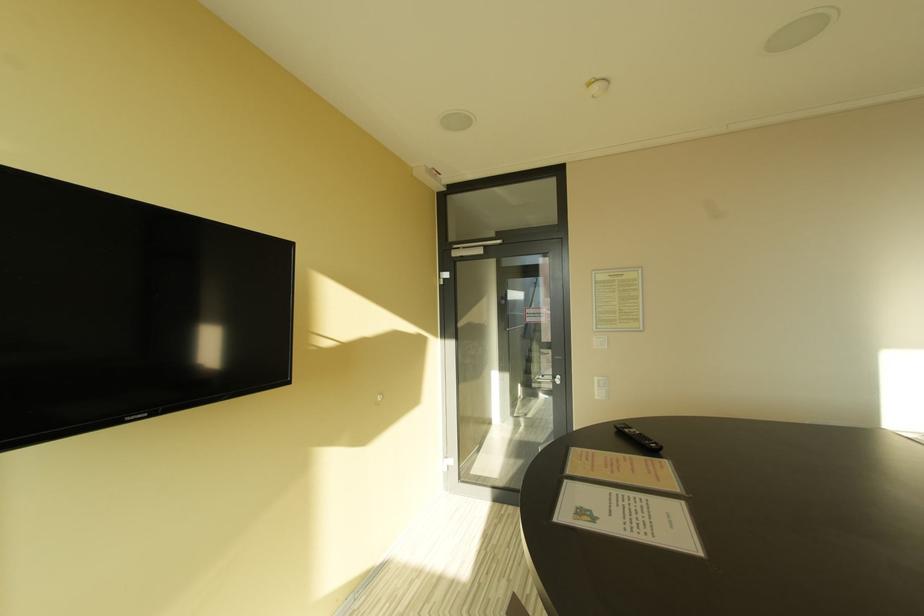
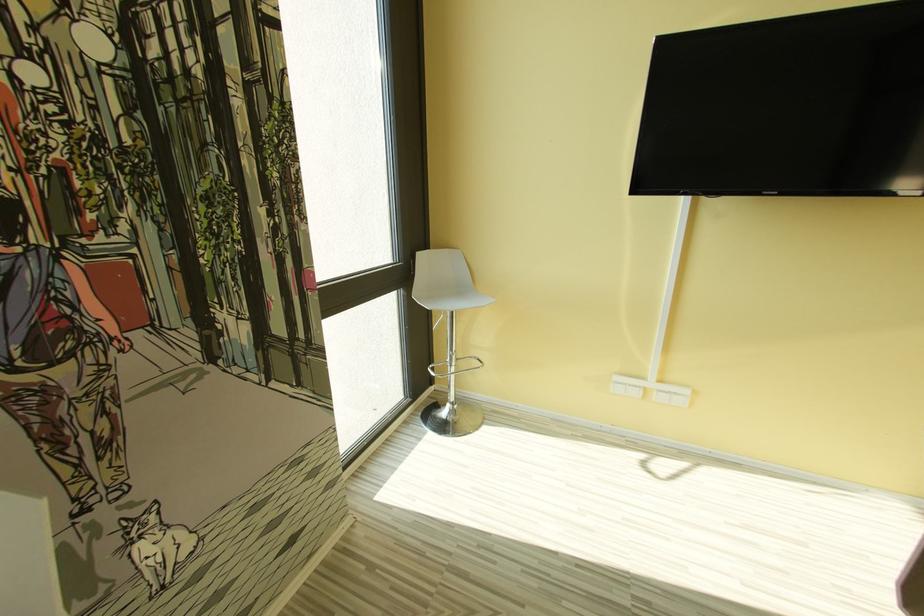
Based on the continuous images, in which direction is the camera rotating?

The rotation direction of the camera is left-down.